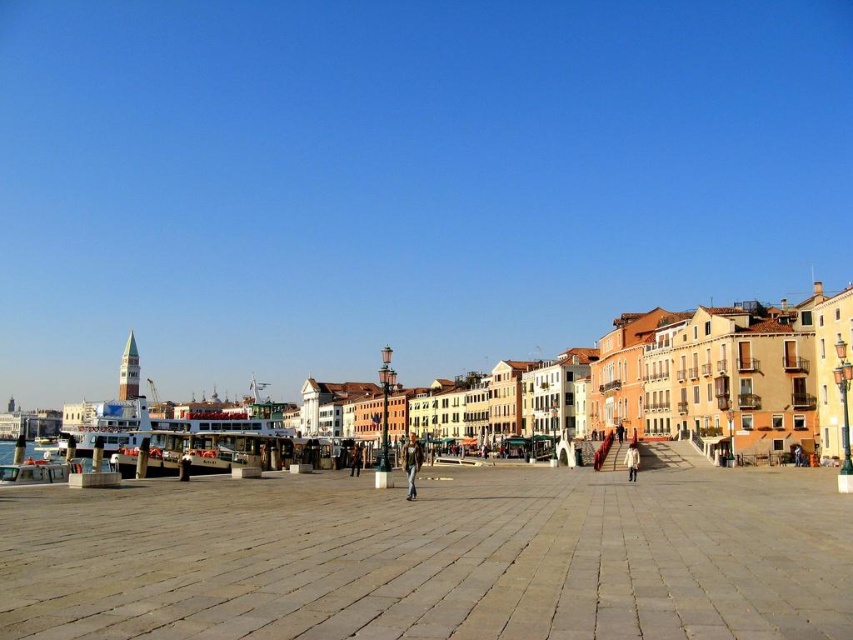
Question: Does light brown stone pavement at center appear on the right side of matte orange building at center?

Choices:
 (A) no
 (B) yes

Answer: (B)

Question: Which point is farther to the camera?

Choices:
 (A) light brown stone pavement at center
 (B) brown leather jacket at center
 (C) matte orange building at center
 (D) white matte coat at center

Answer: (B)

Question: Is leather jacket at center to the left of white matte coat at center from the viewer's perspective?

Choices:
 (A) no
 (B) yes

Answer: (B)

Question: Among these points, which one is farthest from the camera?

Choices:
 (A) (728, 381)
 (B) (345, 628)

Answer: (A)

Question: Which point is closer to the camera?

Choices:
 (A) white matte coat at center
 (B) matte orange building at center

Answer: (B)

Question: Can you confirm if light brown stone pavement at center is bigger than white matte coat at center?

Choices:
 (A) yes
 (B) no

Answer: (A)